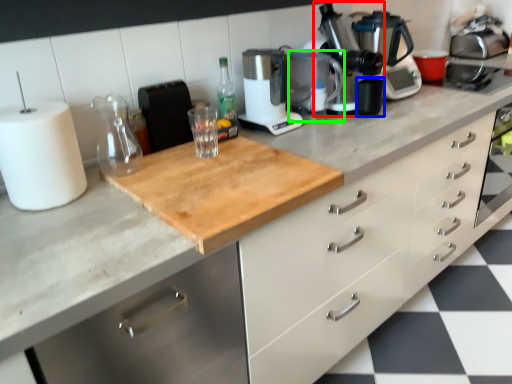
Question: Which object is positioned farthest from coffee machine (highlighted by a red box)? Select from appliance (highlighted by a blue box) and appliance (highlighted by a green box).

Choices:
 (A) appliance
 (B) appliance

Answer: (B)